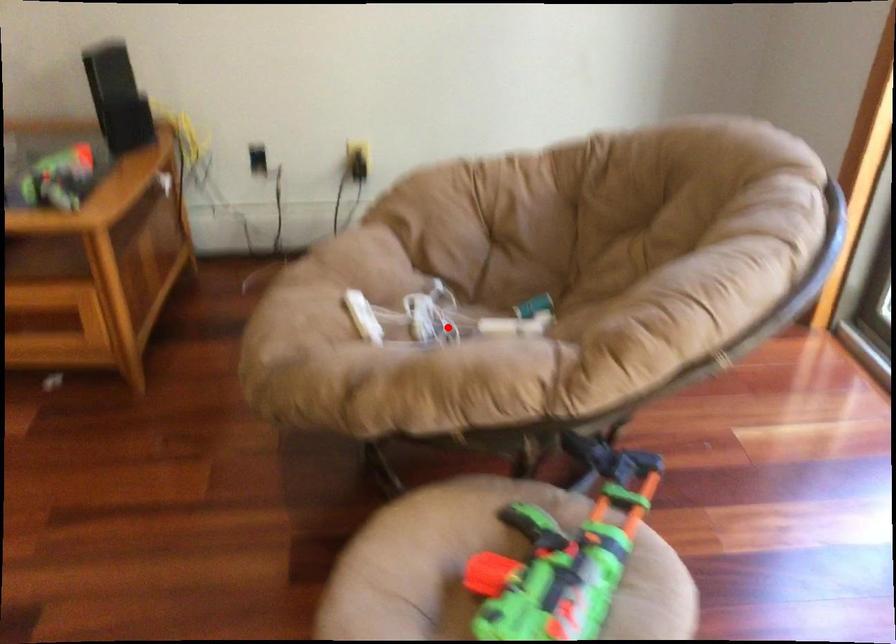
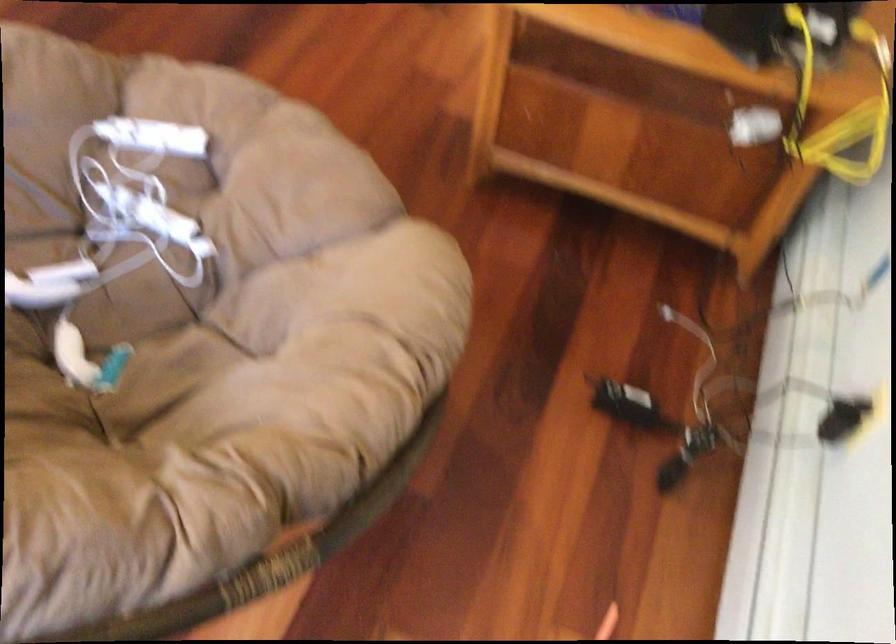
Question: I am providing you with two images of the same scene from different viewpoints. A red point is shown in image1. For the corresponding object point in image2, is it positioned nearer or farther from the camera?

Choices:
 (A) Nearer
 (B) Farther

Answer: (A)